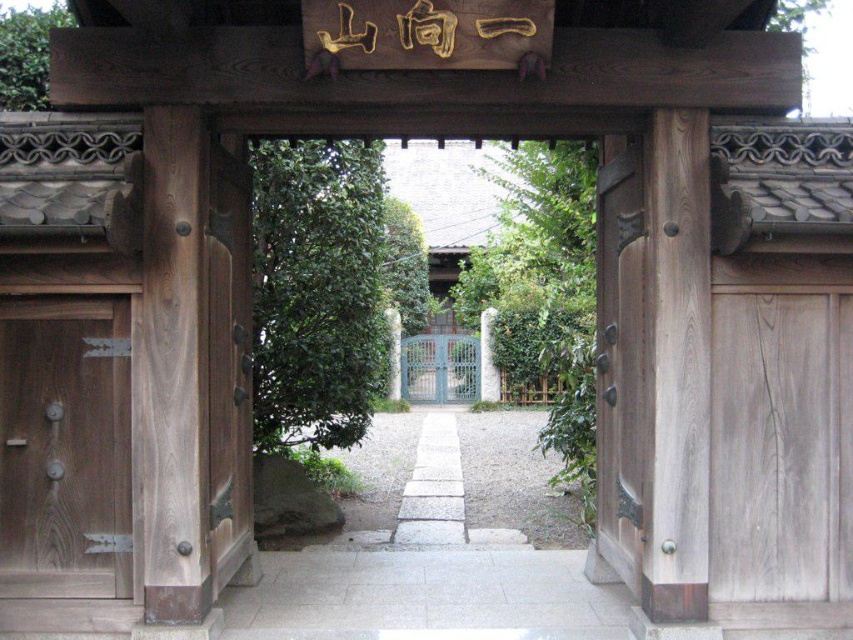
Question: Does smooth wooden door at right appear over white stone path at center?

Choices:
 (A) no
 (B) yes

Answer: (B)

Question: Can you confirm if smooth gray wood door at right is positioned above wooden door at left?

Choices:
 (A) yes
 (B) no

Answer: (A)

Question: Can you confirm if smooth wooden door at right is positioned to the left of white stone path at center?

Choices:
 (A) yes
 (B) no

Answer: (B)

Question: Which object appears closest to the camera in this image?

Choices:
 (A) smooth gray wood door at right
 (B) wooden door at left

Answer: (B)

Question: Which object is closer to the camera taking this photo?

Choices:
 (A) wooden door at left
 (B) smooth wooden door at right
 (C) smooth gray wood door at right
 (D) gray stone path at center

Answer: (A)

Question: Which point is closer to the camera taking this photo?

Choices:
 (A) (780, 273)
 (B) (80, 534)
 (C) (502, 612)

Answer: (B)